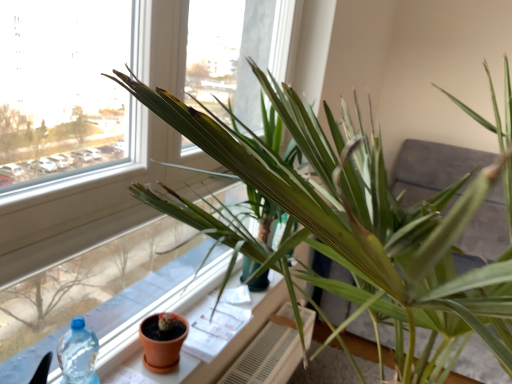
Question: Is white textured radiator at lower center thinner than terracotta clay pot at lower left?

Choices:
 (A) yes
 (B) no

Answer: (B)

Question: From a real-world perspective, does white textured radiator at lower center stand above terracotta clay pot at lower left?

Choices:
 (A) no
 (B) yes

Answer: (A)

Question: Is white textured radiator at lower center with terracotta clay pot at lower left?

Choices:
 (A) yes
 (B) no

Answer: (B)

Question: Is white textured radiator at lower center oriented towards terracotta clay pot at lower left?

Choices:
 (A) yes
 (B) no

Answer: (B)

Question: Is white textured radiator at lower center bigger than terracotta clay pot at lower left?

Choices:
 (A) yes
 (B) no

Answer: (A)

Question: From the image's perspective, is white textured radiator at lower center positioned above or below green matte plant at center?

Choices:
 (A) above
 (B) below

Answer: (B)

Question: Does point (250, 380) appear closer or farther from the camera than point (434, 236)?

Choices:
 (A) closer
 (B) farther

Answer: (B)

Question: Considering the positions of white textured radiator at lower center and green matte plant at center in the image, is white textured radiator at lower center wider or thinner than green matte plant at center?

Choices:
 (A) wide
 (B) thin

Answer: (B)

Question: Relative to green matte plant at center, is white textured radiator at lower center in front or behind?

Choices:
 (A) behind
 (B) front

Answer: (A)

Question: Considering their positions, is terracotta clay pot at lower center located in front of or behind white textured radiator at lower center?

Choices:
 (A) front
 (B) behind

Answer: (A)

Question: Would you say terracotta clay pot at lower center is to the left or to the right of white textured radiator at lower center in the picture?

Choices:
 (A) right
 (B) left

Answer: (B)

Question: From their relative heights in the image, would you say terracotta clay pot at lower center is taller or shorter than white textured radiator at lower center?

Choices:
 (A) short
 (B) tall

Answer: (A)

Question: Is terracotta clay pot at lower center bigger or smaller than white textured radiator at lower center?

Choices:
 (A) big
 (B) small

Answer: (B)

Question: Is green matte plant at center situated inside terracotta clay pot at lower left or outside?

Choices:
 (A) outside
 (B) inside

Answer: (A)

Question: From the image's perspective, is green matte plant at center above or below terracotta clay pot at lower left?

Choices:
 (A) above
 (B) below

Answer: (A)